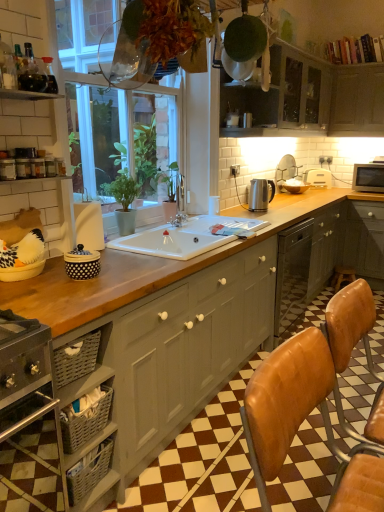
Question: Considering their positions, is matte gray cabinet at center, which is counted as the 3th cabinetry, starting from the right, located in front of or behind matte gray cabinets at upper center, positioned as the 2th cabinetry in left-to-right order?

Choices:
 (A) front
 (B) behind

Answer: (A)

Question: From the image's perspective, relative to matte gray cabinets at upper center, the second cabinetry from the bottom, is matte gray cabinet at center, placed as the 1th cabinetry when sorted from left to right, above or below?

Choices:
 (A) above
 (B) below

Answer: (B)

Question: Which object is positioned closest to the matte black microwave at upper right, marked as the seventh appliance in a left-to-right arrangement?

Choices:
 (A) white plastic toaster at upper right, which ranks as the 2th appliance in right-to-left order
 (B) brown leather bar stool at lower right
 (C) matte gray cabinet at upper center, marked as the 1th cabinetry in a top-to-bottom arrangement
 (D) polka dot ceramic jar at left, which is the seventh appliance from back to front
 (E) silver metallic kettle at center, which ranks as the 3th appliance in right-to-left order

Answer: (A)

Question: Which object is positioned farthest from the matte gray cabinet at upper center, marked as the 1th cabinetry in a top-to-bottom arrangement?

Choices:
 (A) white plastic toaster at upper right, placed as the 6th appliance when sorted from left to right
 (B) white ceramic sink at center
 (C) metallic silver kettle at upper center, which is the sixth appliance from right to left
 (D) leather at right
 (E) matte gray cabinets at upper center, the second cabinetry positioned from the top

Answer: (D)